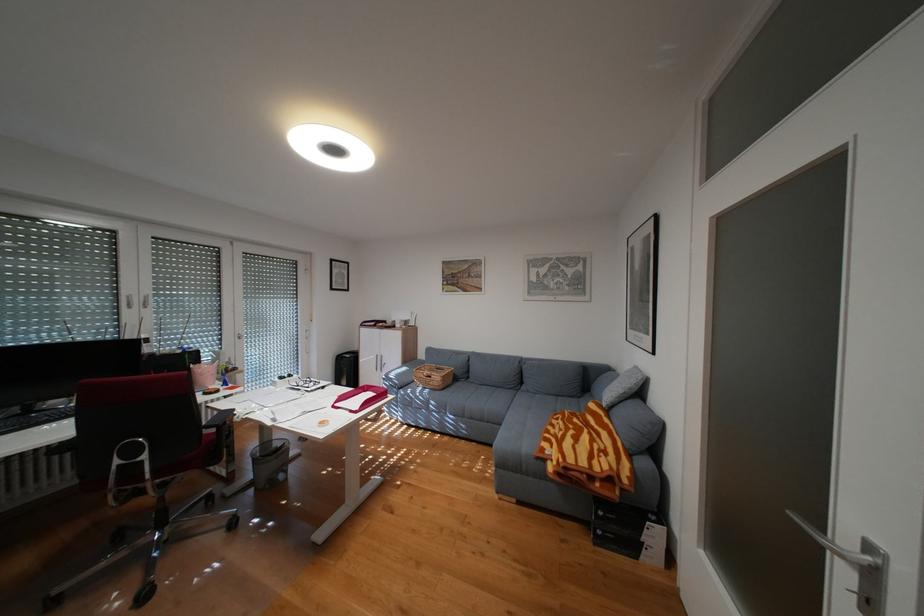
Find the location of a particular element. middle blue sofa sitting surface is located at coordinates (492, 397).